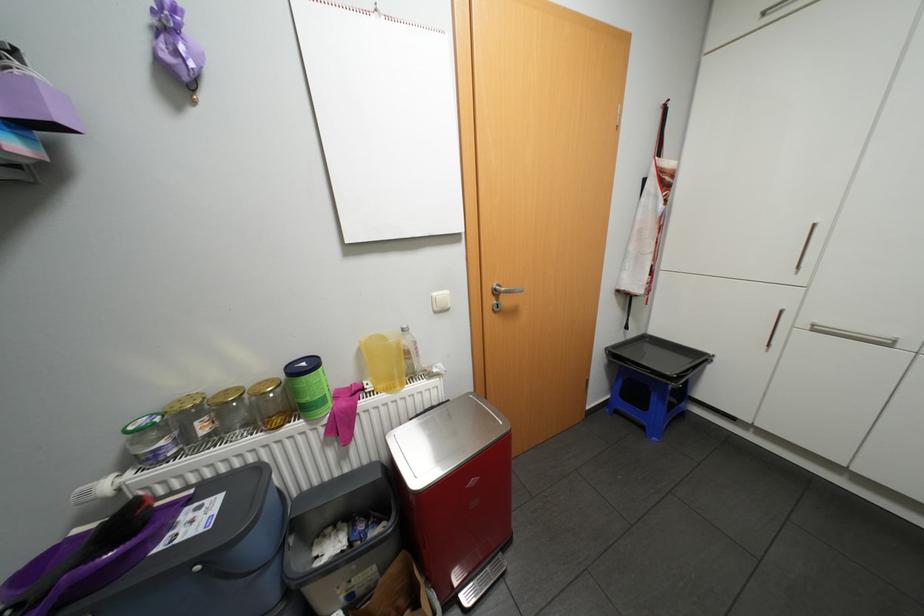
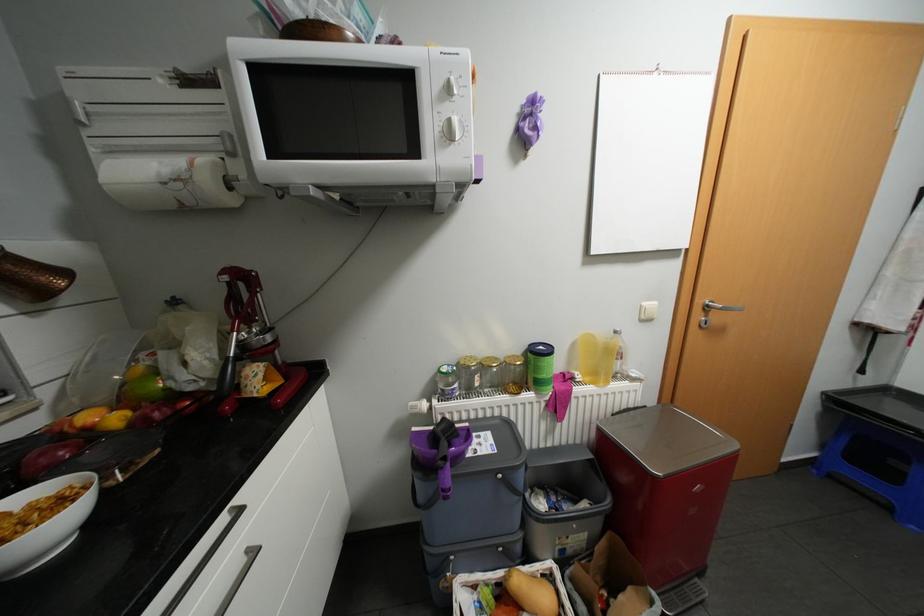
Locate, in the second image, the point that corresponds to pixel 377 386 in the first image.

(587, 377)